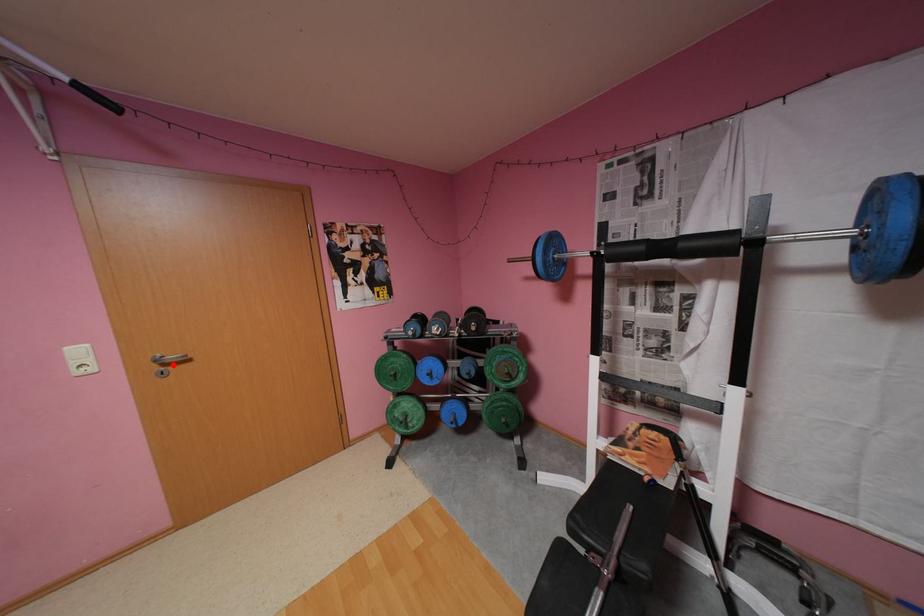
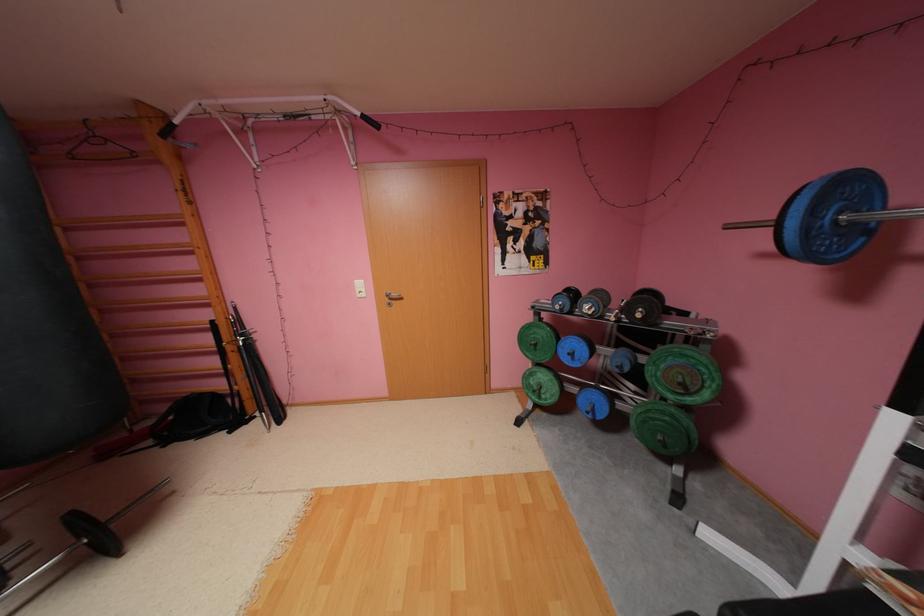
Locate, in the second image, the point that corresponds to the highlighted location in the first image.

(399, 299)